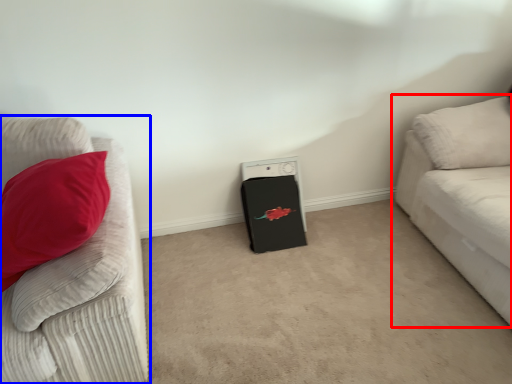
Question: Among these objects, which one is nearest to the camera, studio couch (highlighted by a red box) or studio couch (highlighted by a blue box)?

Choices:
 (A) studio couch
 (B) studio couch

Answer: (B)